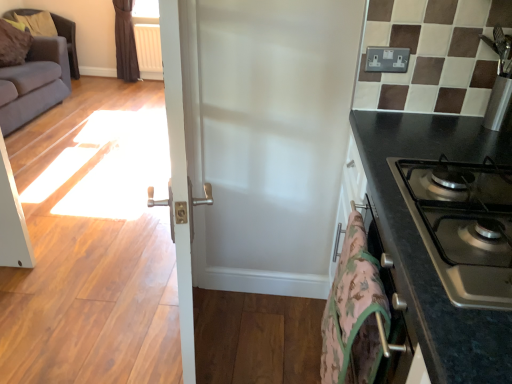
Question: Is black granite countertop at right far away from white plastic radiator at upper left?

Choices:
 (A) yes
 (B) no

Answer: (A)

Question: From the image's perspective, is black granite countertop at right over white plastic radiator at upper left?

Choices:
 (A) yes
 (B) no

Answer: (B)

Question: Could white plastic radiator at upper left be considered to be inside black granite countertop at right?

Choices:
 (A) no
 (B) yes

Answer: (A)

Question: Does black granite countertop at right come behind white plastic radiator at upper left?

Choices:
 (A) no
 (B) yes

Answer: (A)

Question: Can you confirm if black granite countertop at right is positioned to the right of white plastic radiator at upper left?

Choices:
 (A) no
 (B) yes

Answer: (B)

Question: Does black granite countertop at right have a larger size compared to white plastic radiator at upper left?

Choices:
 (A) no
 (B) yes

Answer: (B)

Question: Is camouflage fabric blanket at lower right smaller than gray fabric couch at left?

Choices:
 (A) no
 (B) yes

Answer: (B)

Question: Is camouflage fabric blanket at lower right facing towards gray fabric couch at left?

Choices:
 (A) yes
 (B) no

Answer: (B)

Question: Can you confirm if camouflage fabric blanket at lower right is thinner than gray fabric couch at left?

Choices:
 (A) no
 (B) yes

Answer: (B)

Question: Is camouflage fabric blanket at lower right wider than gray fabric couch at left?

Choices:
 (A) no
 (B) yes

Answer: (A)

Question: From a real-world perspective, is camouflage fabric blanket at lower right located beneath gray fabric couch at left?

Choices:
 (A) no
 (B) yes

Answer: (A)

Question: Can you confirm if camouflage fabric blanket at lower right is taller than gray fabric couch at left?

Choices:
 (A) no
 (B) yes

Answer: (A)

Question: Is camouflage fabric blanket at lower right shorter than white plastic radiator at upper left?

Choices:
 (A) no
 (B) yes

Answer: (B)